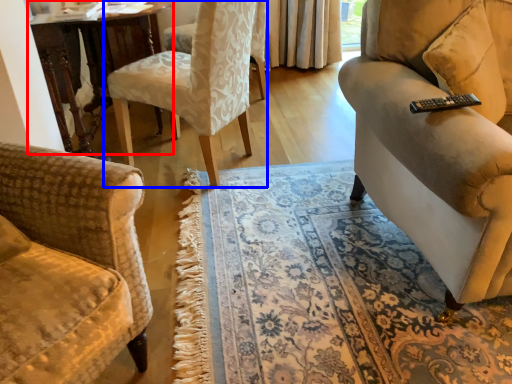
Question: Which point is further to the camera, table (highlighted by a red box) or chair (highlighted by a blue box)?

Choices:
 (A) table
 (B) chair

Answer: (A)